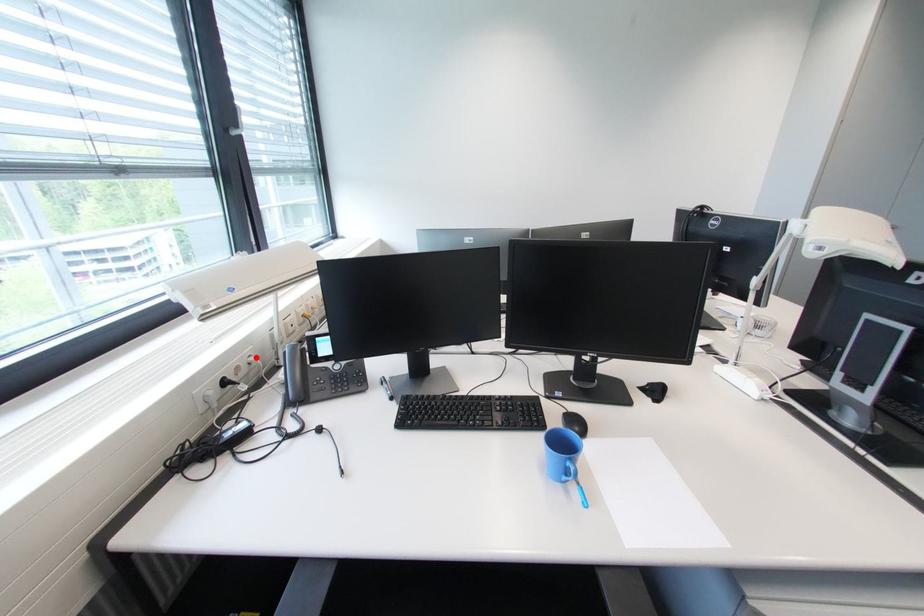
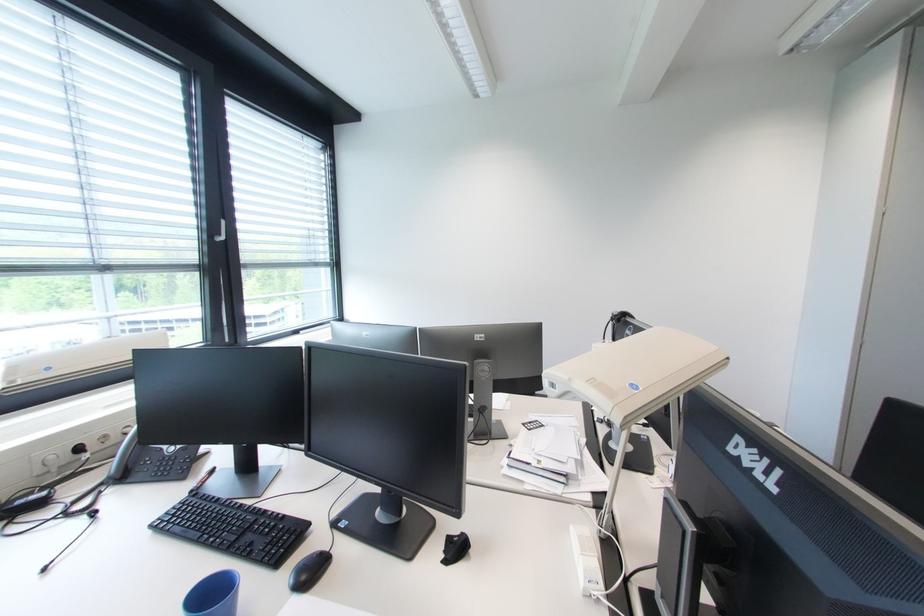
Locate, in the second image, the point that corresponds to the highlighted location in the first image.

(134, 428)